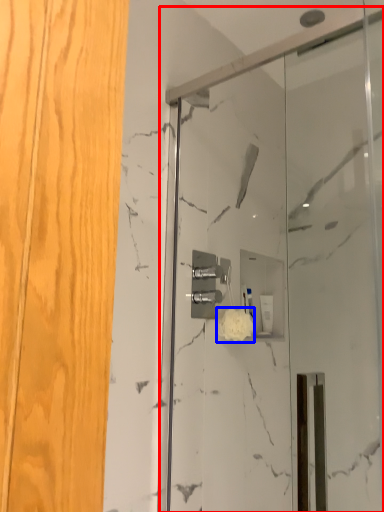
Question: Which of the following is the farthest to the observer, screen door (highlighted by a red box) or flower (highlighted by a blue box)?

Choices:
 (A) screen door
 (B) flower

Answer: (B)